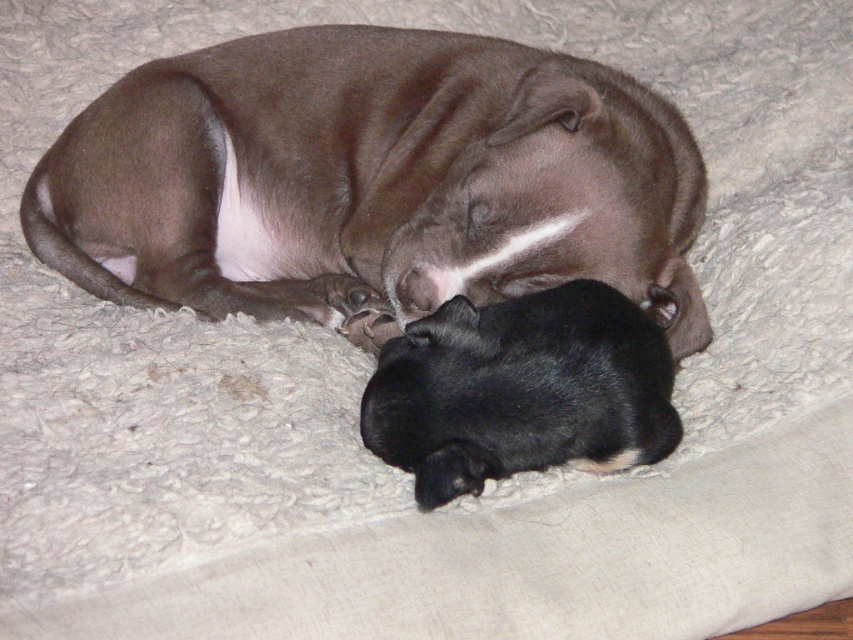
The image size is (853, 640). What do you see at coordinates (370, 180) in the screenshot?
I see `brown smooth dog at center` at bounding box center [370, 180].

Between point (157, 284) and point (653, 344), which one is positioned behind?

Positioned behind is point (157, 284).

Who is more distant from viewer, (86, 115) or (595, 435)?

The point (86, 115) is more distant.

The width and height of the screenshot is (853, 640). What are the coordinates of `brown smooth dog at center` in the screenshot? It's located at (370, 180).